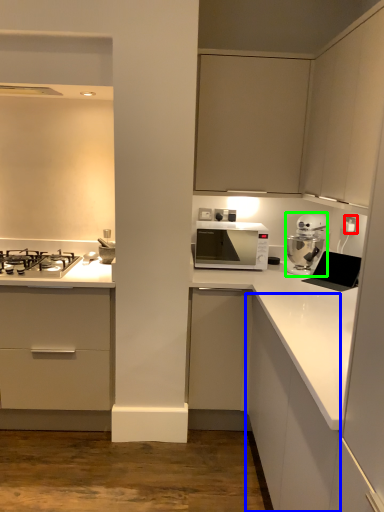
Question: Based on their relative distances, which object is nearer to electric outlet (highlighted by a red box)? Choose from cabinetry (highlighted by a blue box) and kitchen appliance (highlighted by a green box).

Choices:
 (A) cabinetry
 (B) kitchen appliance

Answer: (B)